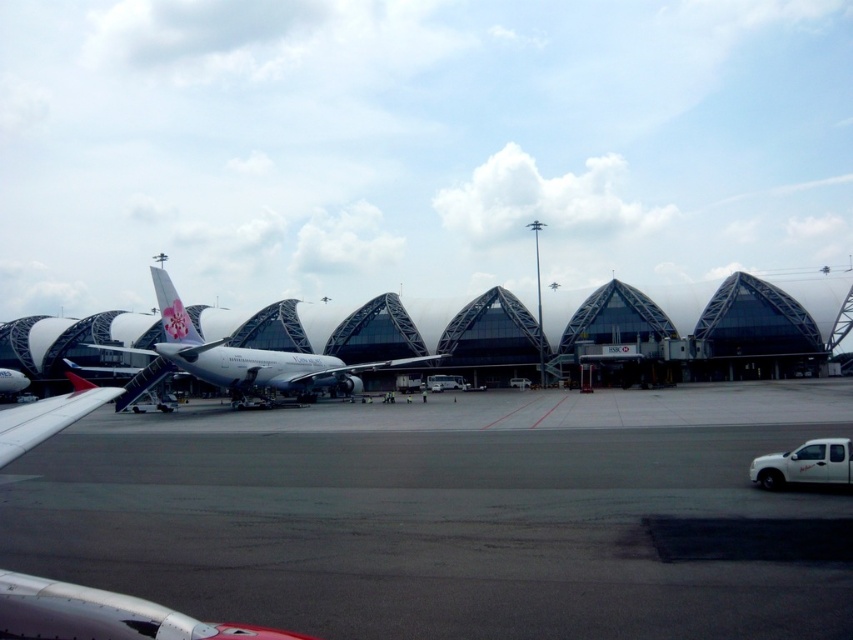
Question: Can you confirm if dark gray asphalt at center is positioned below white matte truck at center?

Choices:
 (A) yes
 (B) no

Answer: (B)

Question: Does white matte car at center have a greater width compared to white matte bus at center?

Choices:
 (A) yes
 (B) no

Answer: (B)

Question: Which point is farther to the camera?

Choices:
 (A) (125, 394)
 (B) (521, 477)
 (C) (144, 390)

Answer: (A)

Question: Considering the real-world distances, which object is farthest from the white matte car at center?

Choices:
 (A) white glossy airplane at left
 (B) white matte truck at lower right
 (C) white glossy airplane at center

Answer: (B)

Question: Which is nearer to the white matte car at center?

Choices:
 (A) white matte truck at lower right
 (B) white matte bus at center

Answer: (A)

Question: Where is dark gray asphalt at center located in relation to white matte car at center in the image?

Choices:
 (A) right
 (B) left

Answer: (A)